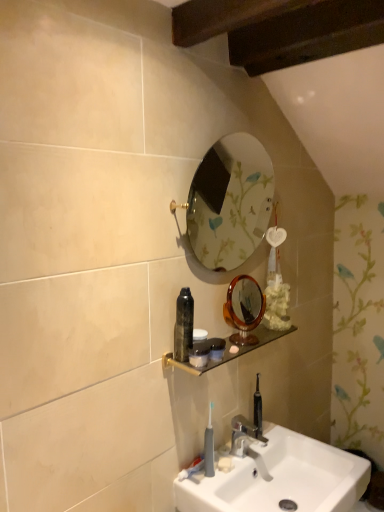
Question: Is gold-framed mirror at upper center, which appears as the 2th mirror when ordered from the bottom, far from black glossy bottle at center, which is counted as the 1th mouthwash, starting from the top?

Choices:
 (A) no
 (B) yes

Answer: (B)

Question: Is gold-framed mirror at upper center, which appears as the 2th mirror when ordered from the bottom, outside of black glossy bottle at center, the 2th mouthwash positioned from the bottom?

Choices:
 (A) yes
 (B) no

Answer: (A)

Question: Is gold-framed mirror at upper center, marked as the first mirror in a top-to-bottom arrangement, at the left side of black glossy bottle at center, which is counted as the 1th mouthwash, starting from the top?

Choices:
 (A) yes
 (B) no

Answer: (B)

Question: From a real-world perspective, is gold-framed mirror at upper center, marked as the first mirror in a top-to-bottom arrangement, on top of black glossy bottle at center, which is counted as the 1th mouthwash, starting from the top?

Choices:
 (A) yes
 (B) no

Answer: (A)

Question: Is gold-framed mirror at upper center, which appears as the 2th mirror when ordered from the bottom, oriented towards black glossy bottle at center, which is counted as the 1th mouthwash, starting from the top?

Choices:
 (A) no
 (B) yes

Answer: (A)

Question: Considering the positions of chrome metallic faucet at lower center and wooden shelf at center in the image, is chrome metallic faucet at lower center wider or thinner than wooden shelf at center?

Choices:
 (A) thin
 (B) wide

Answer: (B)

Question: Does point (259, 437) appear closer or farther from the camera than point (168, 359)?

Choices:
 (A) closer
 (B) farther

Answer: (B)

Question: Is chrome metallic faucet at lower center to the left or to the right of wooden shelf at center in the image?

Choices:
 (A) left
 (B) right

Answer: (B)

Question: Relative to wooden shelf at center, is chrome metallic faucet at lower center in front or behind?

Choices:
 (A) front
 (B) behind

Answer: (B)

Question: In terms of size, does amber glass mirror at center, which is the 1th mirror from bottom to top, appear bigger or smaller than white matte soap at lower center?

Choices:
 (A) small
 (B) big

Answer: (B)

Question: From the image's perspective, is amber glass mirror at center, which is the 1th mirror from bottom to top, positioned above or below white matte soap at lower center?

Choices:
 (A) below
 (B) above

Answer: (B)

Question: Is point (246, 287) positioned closer to the camera than point (223, 461)?

Choices:
 (A) farther
 (B) closer

Answer: (A)

Question: Is amber glass mirror at center, which is counted as the second mirror, starting from the top, spatially inside white matte soap at lower center, or outside of it?

Choices:
 (A) inside
 (B) outside

Answer: (B)

Question: In terms of height, does translucent plastic container at center look taller or shorter compared to chrome metallic faucet at lower center?

Choices:
 (A) tall
 (B) short

Answer: (B)

Question: Does point (210, 351) appear closer or farther from the camera than point (241, 434)?

Choices:
 (A) closer
 (B) farther

Answer: (A)